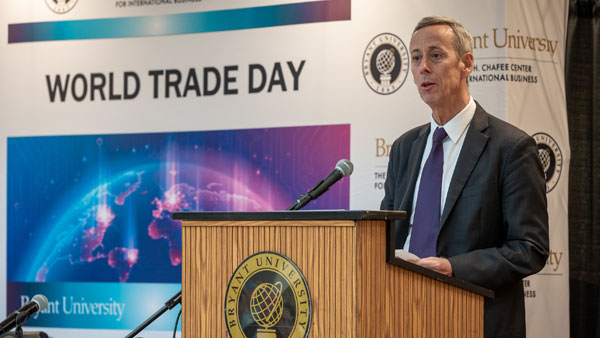
I want to click on globe, so click(242, 322).